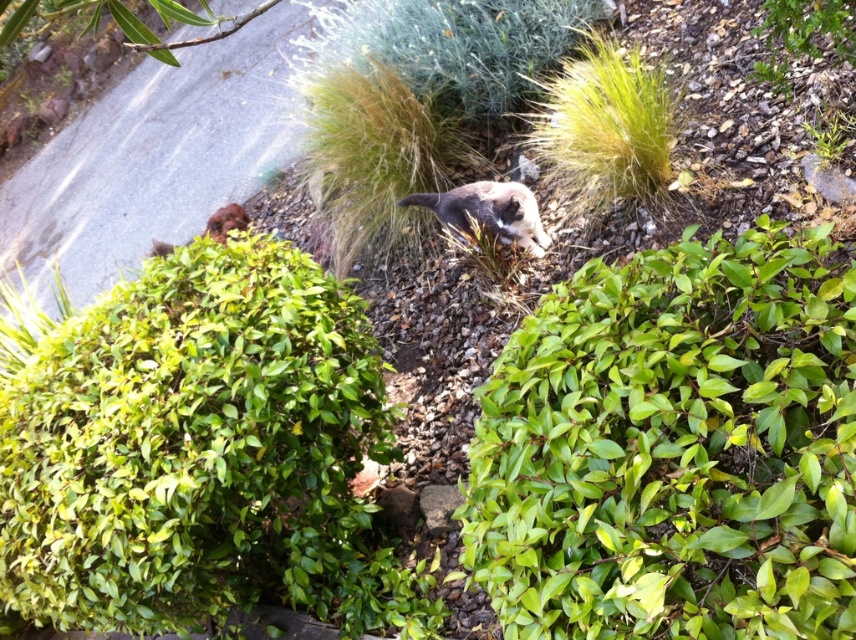
Who is higher up, green leafy shrub at center or fuzzy gray cat at center?

fuzzy gray cat at center

Does green leafy shrub at center have a greater height compared to fuzzy gray cat at center?

Correct, green leafy shrub at center is much taller as fuzzy gray cat at center.

Find the location of a particular element. green leafy shrub at center is located at coordinates (675, 449).

Identify the location of green leafy shrub at center. (675, 449).

Is point (265, 248) less distant than point (474, 72)?

Yes, point (265, 248) is in front of point (474, 72).

Does green leafy hedge at center come in front of green fuzzy bush at upper center?

Yes, green leafy hedge at center is closer to the viewer.

Based on the photo, who is more forward, (311, 371) or (346, 13)?

Positioned in front is point (311, 371).

The image size is (856, 640). Find the location of `green leafy hedge at center`. green leafy hedge at center is located at coordinates (201, 452).

The image size is (856, 640). I want to click on green leafy shrub at center, so click(675, 449).

Can you confirm if green leafy shrub at center is smaller than green leafy hedge at center?

Yes.

Find the location of a particular element. green leafy shrub at center is located at coordinates (675, 449).